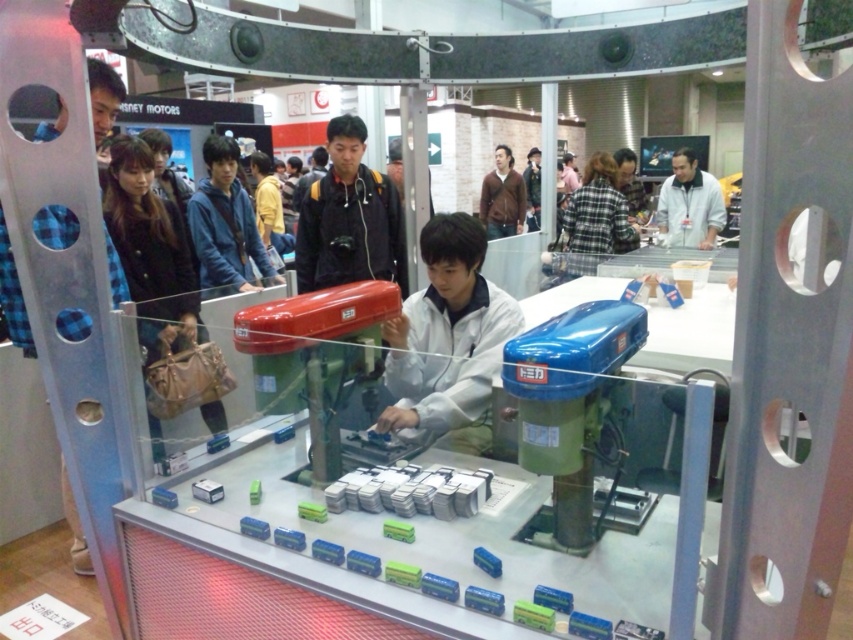
Is point (399, 400) behind point (521, 216)?

No, it is not.

Is white matte jacket at center thinner than brown leather jacket at upper center?

Yes.

Find the location of a particular element. This screenshot has height=640, width=853. white matte jacket at center is located at coordinates (448, 339).

Is leather handbag at left to the right of brown leather jacket at upper center from the viewer's perspective?

In fact, leather handbag at left is to the left of brown leather jacket at upper center.

Is leather handbag at left bigger than brown leather jacket at upper center?

Yes.

Between point (175, 236) and point (498, 156), which one is positioned in front?

Point (175, 236) is more forward.

Find the location of a particular element. The height and width of the screenshot is (640, 853). leather handbag at left is located at coordinates (152, 252).

Who is taller, blue plaid shirt at left or plaid fabric shirt at center?

With more height is plaid fabric shirt at center.

Which of these two, blue plaid shirt at left or plaid fabric shirt at center, stands shorter?

Standing shorter between the two is blue plaid shirt at left.

Where is `blue plaid shirt at left`? The height and width of the screenshot is (640, 853). blue plaid shirt at left is located at coordinates (12, 296).